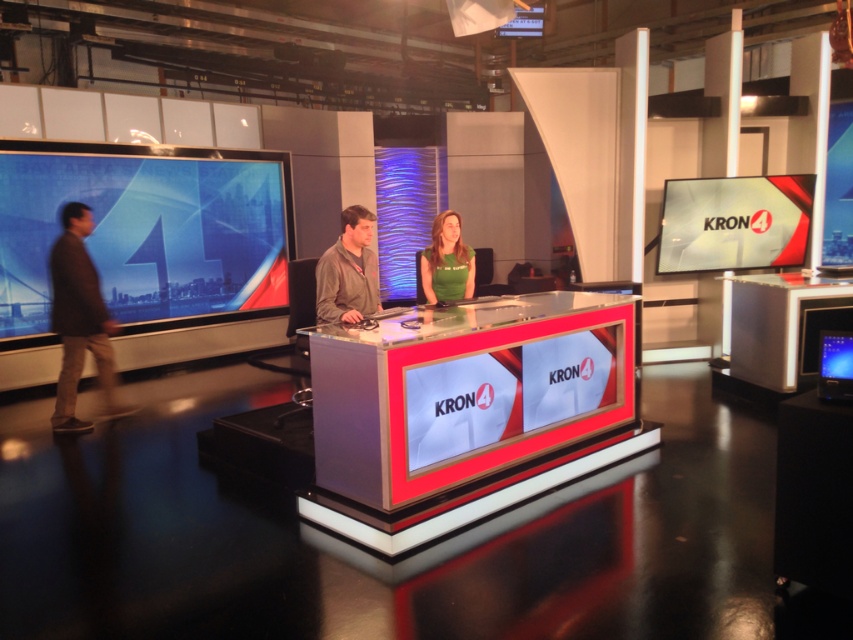
Question: Which point appears farthest from the camera in this image?

Choices:
 (A) (335, 244)
 (B) (61, 259)
 (C) (431, 244)

Answer: (C)

Question: Does brown leather jacket at left appear on the left side of matte gray jacket at center?

Choices:
 (A) yes
 (B) no

Answer: (A)

Question: Can you confirm if brown leather jacket at left is bigger than green fabric shirt at center?

Choices:
 (A) no
 (B) yes

Answer: (B)

Question: Which of the following is the closest to the observer?

Choices:
 (A) (59, 296)
 (B) (448, 253)

Answer: (B)

Question: Does matte gray jacket at center appear on the left side of green fabric shirt at center?

Choices:
 (A) yes
 (B) no

Answer: (A)

Question: Among these objects, which one is farthest from the camera?

Choices:
 (A) matte gray jacket at center
 (B) brown leather jacket at left

Answer: (B)